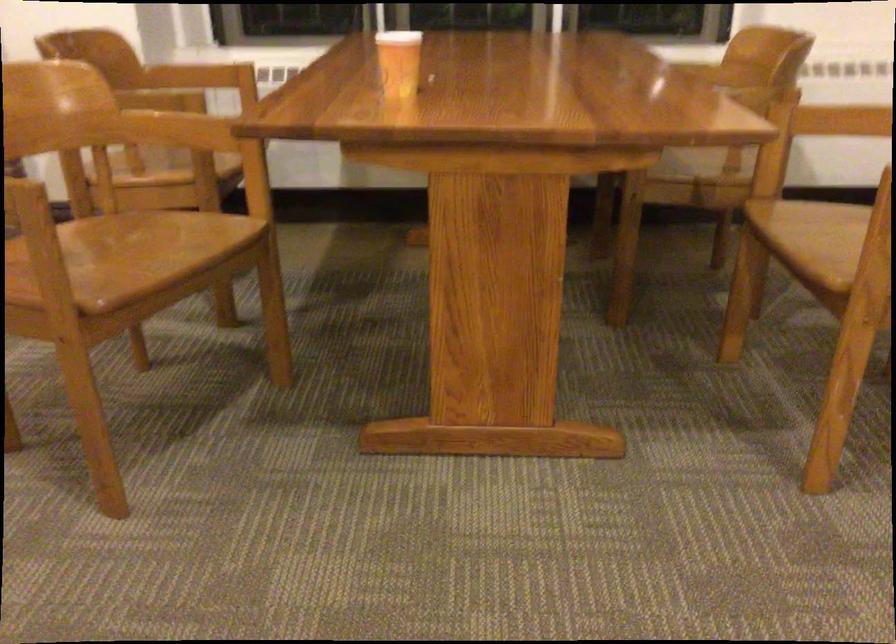
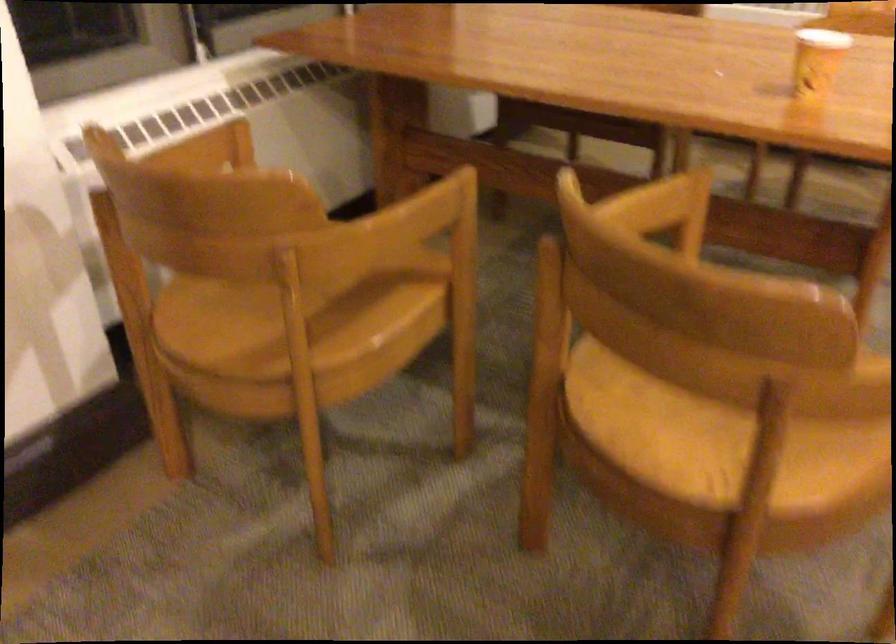
Where in the second image is the point corresponding to point (195, 135) from the first image?

(650, 205)